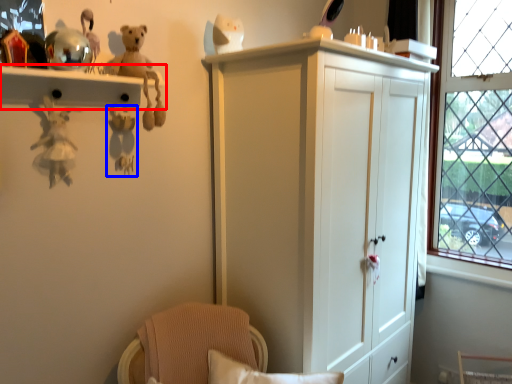
Question: Among these objects, which one is farthest to the camera, shelf (highlighted by a red box) or toy (highlighted by a blue box)?

Choices:
 (A) shelf
 (B) toy

Answer: (B)